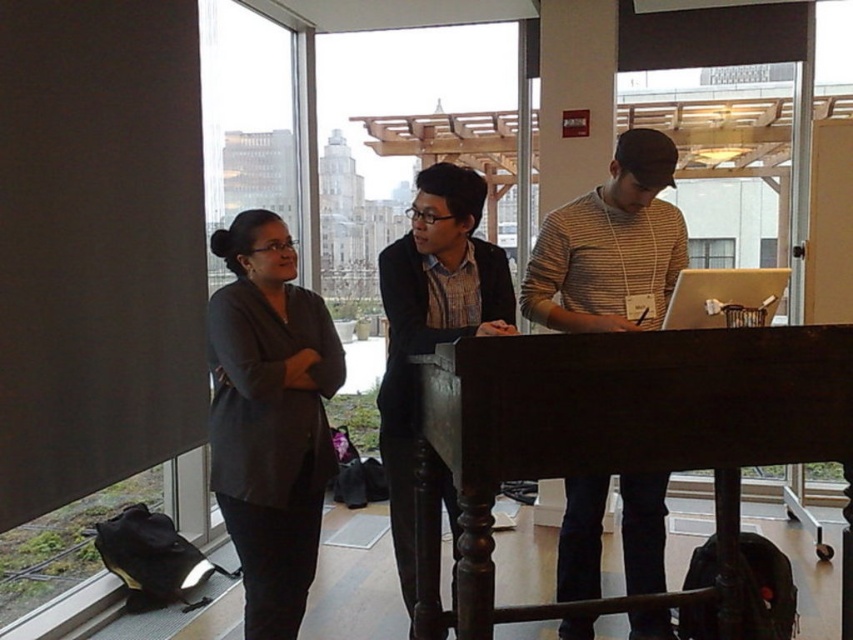
You are an office worker who needs to determine the spatial arrangement of clothing items in the room. Which clothing item, the dark gray blazer at left or the striped sweater at center, is closer to the floor?

The dark gray blazer at left is positioned under the striped sweater at center, so it is closer to the floor.